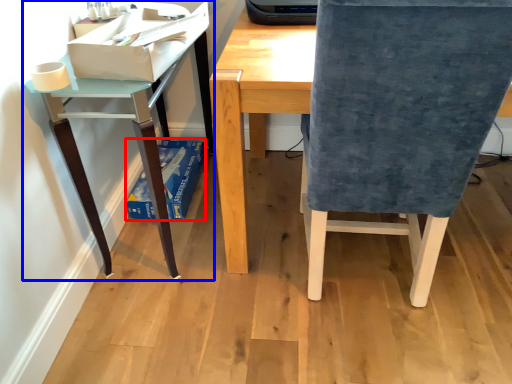
Question: Which point is closer to the camera, paperback book (highlighted by a red box) or table (highlighted by a blue box)?

Choices:
 (A) paperback book
 (B) table

Answer: (B)